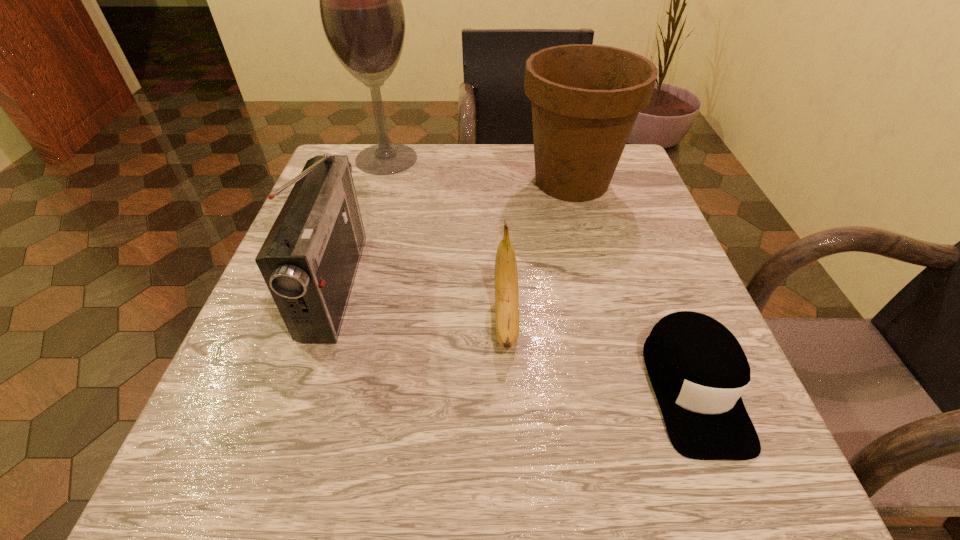
Locate an element on the screen. The image size is (960, 540). vacant area between the flowerpot and the third object from left to right is located at coordinates (540, 251).

You are a GUI agent. You are given a task and a screenshot of the screen. Output one action in this format:
    pyautogui.click(x=<x>, y=<y>)
    Task: Click on the object that ranks as the third closest to the alcohol
    This screenshot has height=540, width=960.
    Given the screenshot: What is the action you would take?
    pyautogui.click(x=506, y=277)

I want to click on the second closest object to the flowerpot, so click(360, 0).